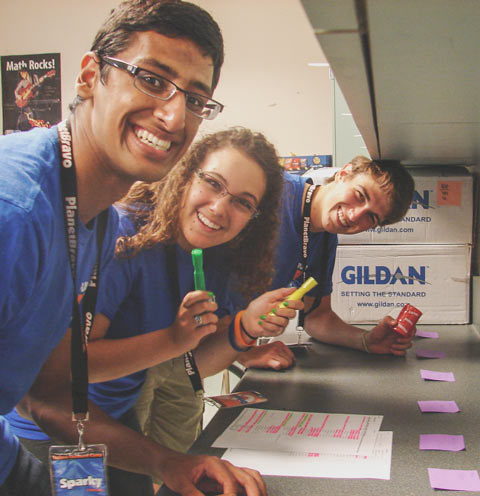
Locate an element on the screen. The height and width of the screenshot is (496, 480). white cardboard boxes is located at coordinates (443, 223), (444, 290).